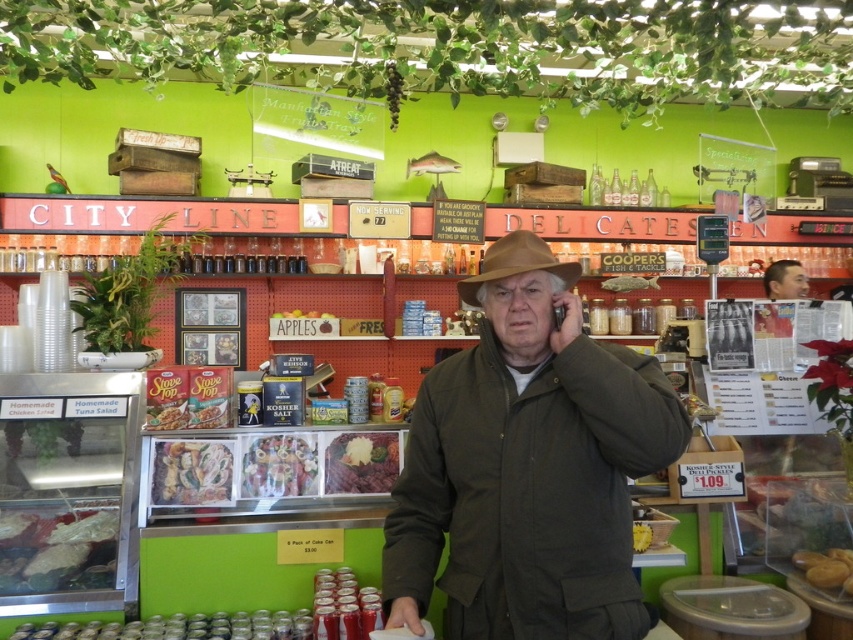
You are a customer at the City Line Delicatessen and want to grab both the shiny plastic deli meat at center and the green matte apples at center. Which item should you reach for first to avoid knocking over the other?

You should reach for the shiny plastic deli meat at center first since it is in front of the green matte apples at center and less likely to cause the apples to fall when moved.

You are standing at the camera position in the deli. There is a point marked at coordinates [50,540] in the image. Can you reach this point without moving your position?

The point at [50,540] is 2.05 meters away from your current position. Since you cannot stretch your arm that far, you cannot reach it without moving.